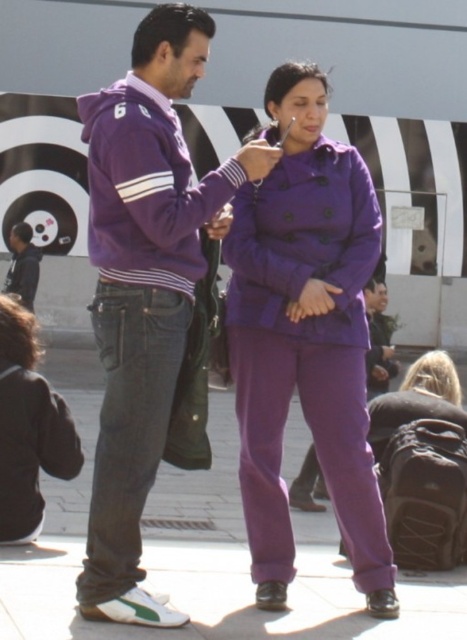
Question: Which point is farther to the camera?

Choices:
 (A) (245, 497)
 (B) (120, 182)
 (C) (318, 189)

Answer: (C)

Question: Which object is closer to the camera taking this photo?

Choices:
 (A) purple woolen coat at center
 (B) purple cotton hoodie at left
 (C) purple fabric pants at center

Answer: (C)

Question: Does purple woolen coat at center have a greater width compared to purple matte jacket at center?

Choices:
 (A) no
 (B) yes

Answer: (B)

Question: Among these objects, which one is farthest from the camera?

Choices:
 (A) purple fabric pants at center
 (B) purple woolen coat at center

Answer: (B)

Question: Is purple cotton hoodie at left bigger than purple matte jacket at center?

Choices:
 (A) yes
 (B) no

Answer: (A)

Question: Can you confirm if matte purple sweatshirt at left is thinner than dark gray cotton jacket at lower left?

Choices:
 (A) yes
 (B) no

Answer: (B)